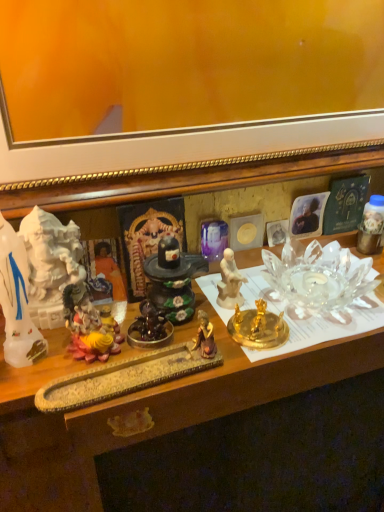
Question: Considering the positions of point (152, 323) and point (87, 318), is point (152, 323) closer or farther from the camera than point (87, 318)?

Choices:
 (A) closer
 (B) farther

Answer: (B)

Question: Looking at the image, does shiny dark brown statue at center, arranged as the 4th toy when viewed from the right, seem bigger or smaller compared to matte yellow statue at center, placed as the 2th toy when sorted from left to right?

Choices:
 (A) small
 (B) big

Answer: (A)

Question: Based on their relative distances, which object is farther from the purple glass vase at center, marked as the second toy in a right-to-left arrangement?

Choices:
 (A) gold metallic tray at center
 (B) orange fabric at center, the first person from the left
 (C) shiny dark brown statue at center, the 3th toy viewed from the left
 (D) matte yellow statue at center, placed as the 5th toy when sorted from right to left
 (E) metallic gold figurine at right, positioned as the 6th toy in left-to-right order

Answer: (A)

Question: Which object is the farthest from the gold metallic candle holder at center?

Choices:
 (A) shiny dark brown statue at center, the 3th toy viewed from the left
 (B) matte yellow statue at center, placed as the 2th toy when sorted from left to right
 (C) purple glass vase at center, marked as the second toy in a right-to-left arrangement
 (D) orange fabric at center, which is the 2th person in right-to-left order
 (E) gold metallic tray at center

Answer: (D)